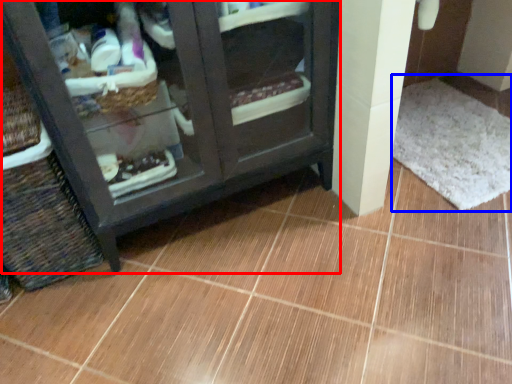
Question: Which point is further to the camera, furniture (highlighted by a red box) or bath mat (highlighted by a blue box)?

Choices:
 (A) furniture
 (B) bath mat

Answer: (B)